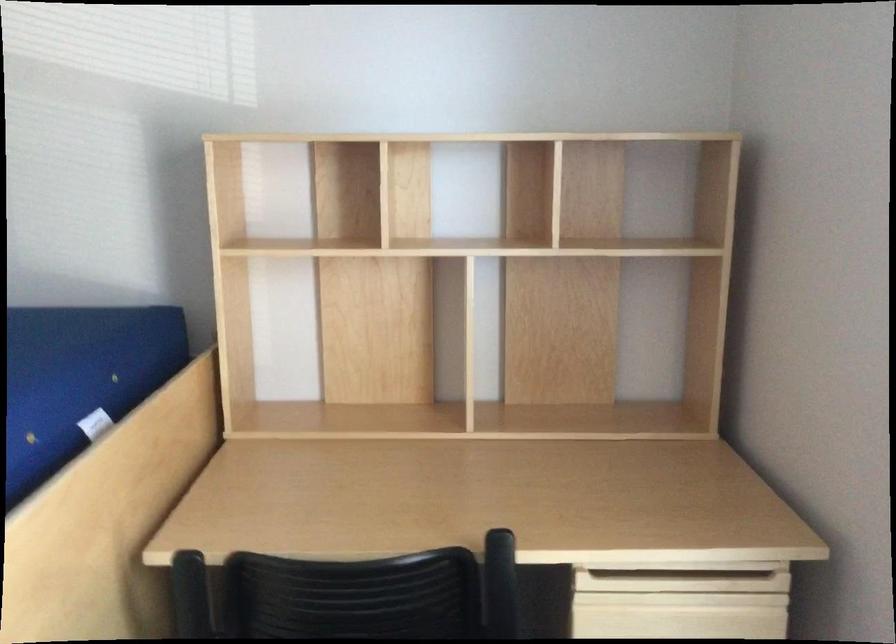
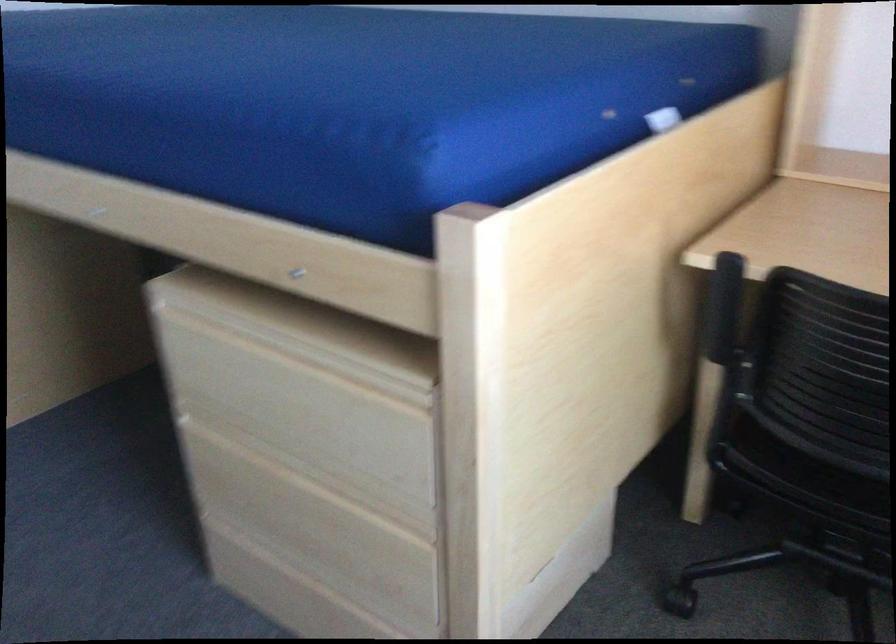
Looking at this image, how did the camera likely rotate?

The rotation direction of the camera is left-down.